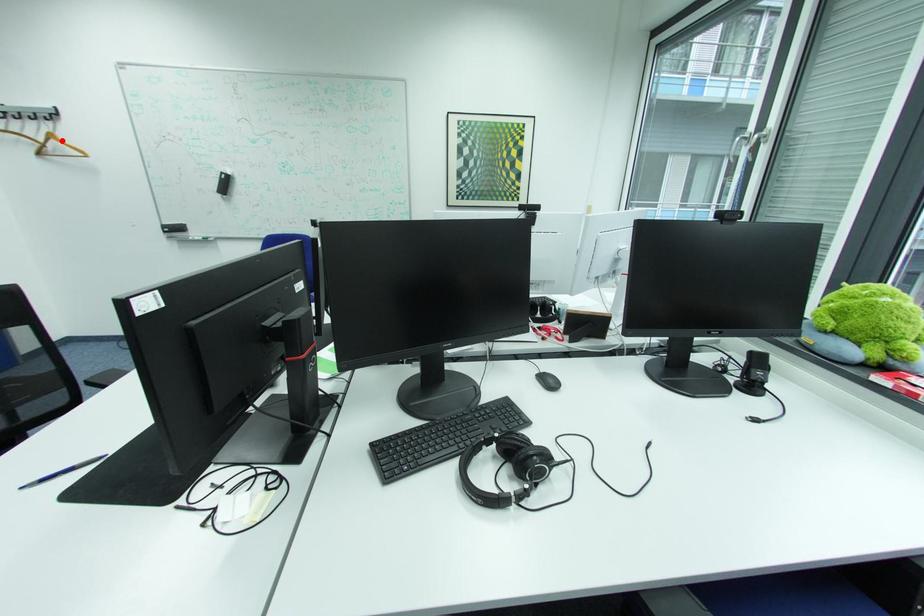
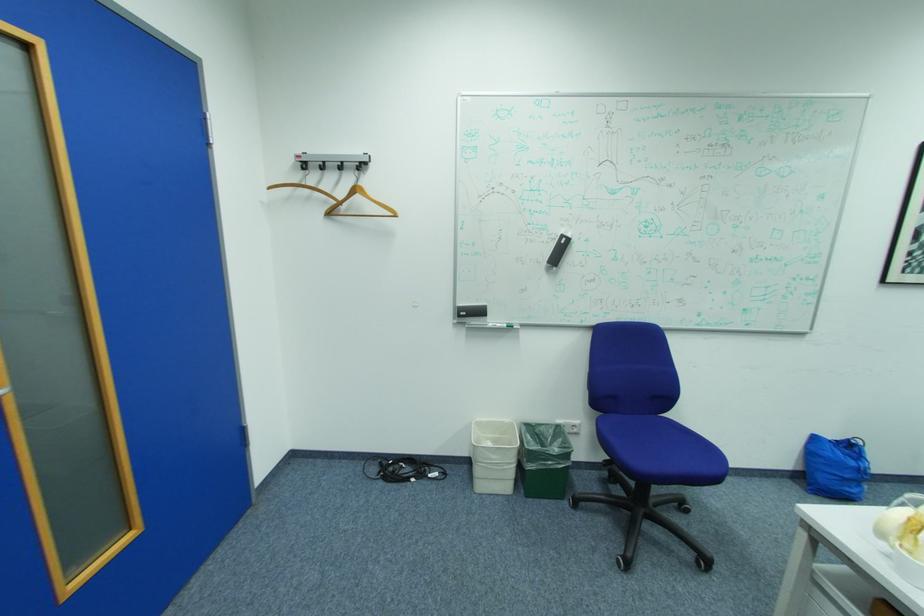
Find the pixel in the second image that matches the highlighted location in the first image.

(366, 197)